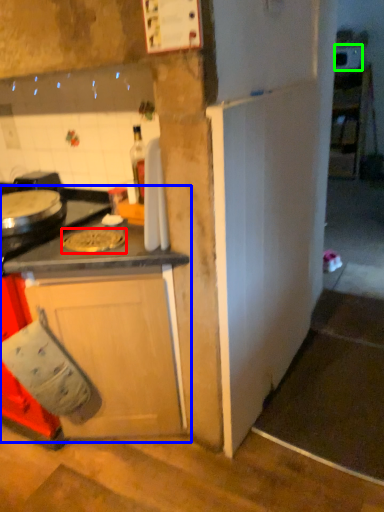
Question: Based on their relative distances, which object is farther from pizza pan (highlighted by a red box)? Choose from cabinetry (highlighted by a blue box) and appliance (highlighted by a green box).

Choices:
 (A) cabinetry
 (B) appliance

Answer: (B)